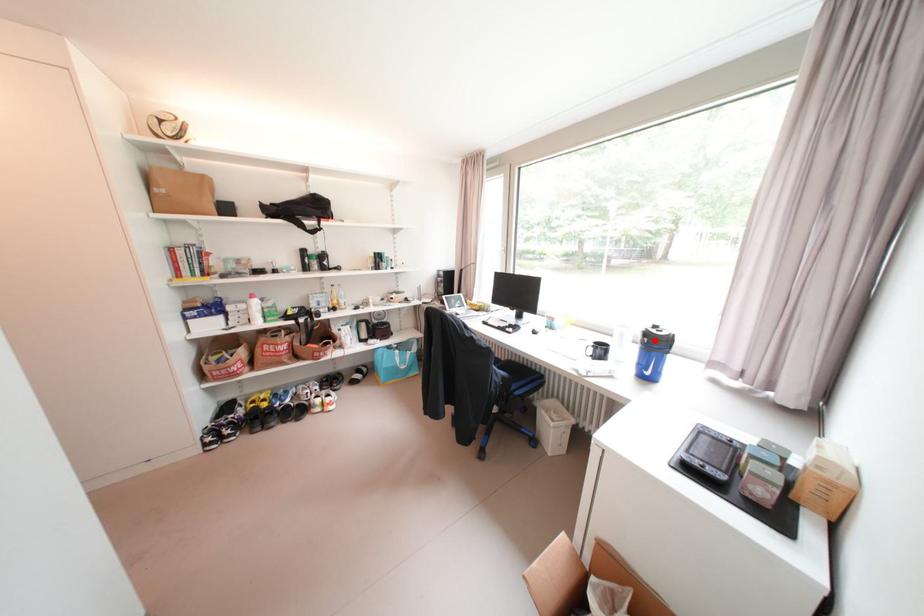
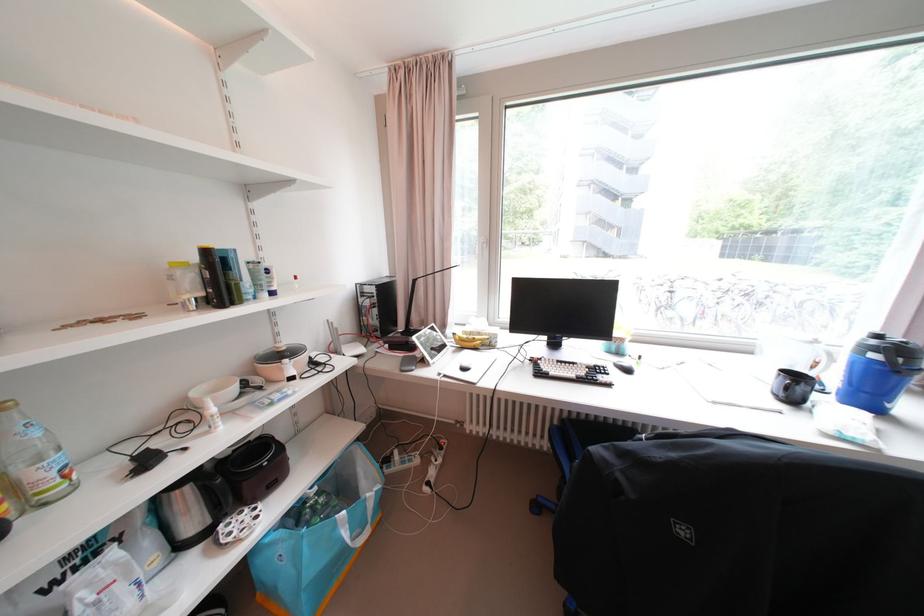
Question: I am providing you with two images of the same scene from different viewpoints. Given a red point in image1, look at the same physical point in image2. Is it:

Choices:
 (A) Closer to the viewpoint
 (B) Farther from the viewpoint

Answer: (A)